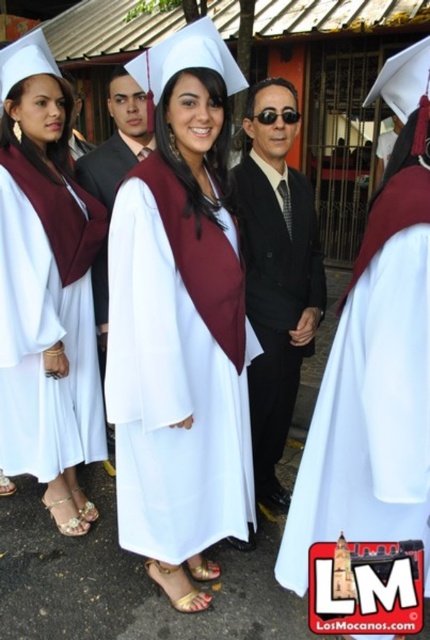
Looking at this image, which is above, white matte graduation gown at center or black satin suit at center?

black satin suit at center is higher up.

Is point (196, 321) farther from camera compared to point (295, 394)?

That is False.

Which is behind, point (116, 376) or point (297, 221)?

Positioned behind is point (297, 221).

At what (x,y) coordinates should I click in order to perform the action: click on white matte graduation gown at center. Please return your answer as a coordinate pair (x, y). The image size is (430, 640). Looking at the image, I should click on (180, 326).

From the picture: Does matte white gown at center have a lesser width compared to shiny black suit at center?

Incorrect, matte white gown at center's width is not less than shiny black suit at center's.

Between matte white gown at center and shiny black suit at center, which one is positioned higher?

shiny black suit at center

I want to click on matte white gown at center, so click(x=46, y=291).

Find the location of a particular element. The image size is (430, 640). matte white gown at center is located at coordinates (46, 291).

Who is taller, black satin suit at center or shiny black suit at center?

black satin suit at center

Can you confirm if black satin suit at center is shorter than shiny black suit at center?

No, black satin suit at center is not shorter than shiny black suit at center.

I want to click on black satin suit at center, so click(x=276, y=273).

You are a GUI agent. You are given a task and a screenshot of the screen. Output one action in this format:
    pyautogui.click(x=<x>, y=<y>)
    Task: Click on the black satin suit at center
    Image resolution: width=430 pixels, height=640 pixels.
    Given the screenshot: What is the action you would take?
    pyautogui.click(x=276, y=273)